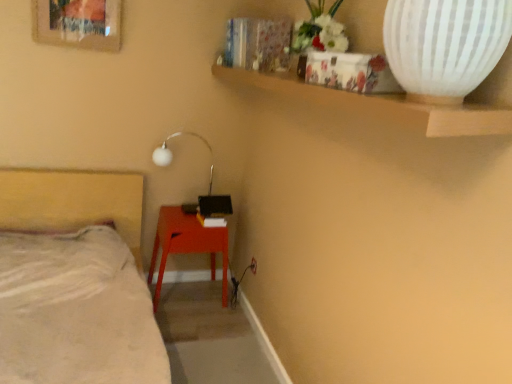
Question: Considering the relative sizes of white glossy lamp at upper center and matte red table at lower center in the image provided, is white glossy lamp at upper center taller than matte red table at lower center?

Choices:
 (A) yes
 (B) no

Answer: (B)

Question: Does white glossy lamp at upper center turn towards matte red table at lower center?

Choices:
 (A) no
 (B) yes

Answer: (A)

Question: Does white glossy lamp at upper center come behind matte red table at lower center?

Choices:
 (A) yes
 (B) no

Answer: (A)

Question: Is there a large distance between white glossy lamp at upper center and matte red table at lower center?

Choices:
 (A) no
 (B) yes

Answer: (A)

Question: Can you confirm if white glossy lamp at upper center is smaller than matte red table at lower center?

Choices:
 (A) no
 (B) yes

Answer: (B)

Question: Can you confirm if white glossy lamp at upper center is positioned to the right of matte red table at lower center?

Choices:
 (A) no
 (B) yes

Answer: (A)

Question: From the image's perspective, is white soft bed at lower left above white glossy lamp at upper center?

Choices:
 (A) no
 (B) yes

Answer: (A)

Question: Is white soft bed at lower left aimed at white glossy lamp at upper center?

Choices:
 (A) yes
 (B) no

Answer: (B)

Question: Is white glossy lamp at upper center a part of white soft bed at lower left?

Choices:
 (A) yes
 (B) no

Answer: (B)

Question: Is white soft bed at lower left positioned far away from white glossy lamp at upper center?

Choices:
 (A) no
 (B) yes

Answer: (A)

Question: Is white soft bed at lower left outside of white glossy lamp at upper center?

Choices:
 (A) no
 (B) yes

Answer: (B)

Question: From the image's perspective, is white soft bed at lower left beneath white glossy lamp at upper center?

Choices:
 (A) no
 (B) yes

Answer: (B)

Question: Is matte red table at lower center a part of white ribbed vase at upper right?

Choices:
 (A) no
 (B) yes

Answer: (A)